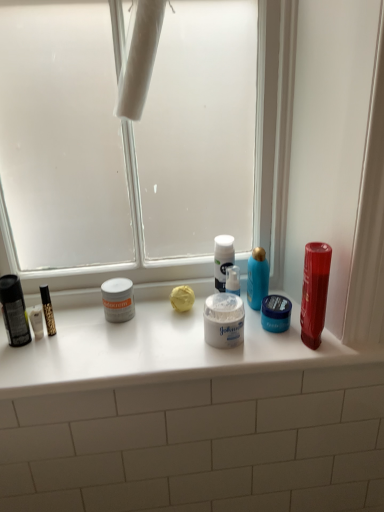
Locate an element on the screen. The width and height of the screenshot is (384, 512). free point above white matte counter at center (from a real-world perspective) is located at coordinates (140, 323).